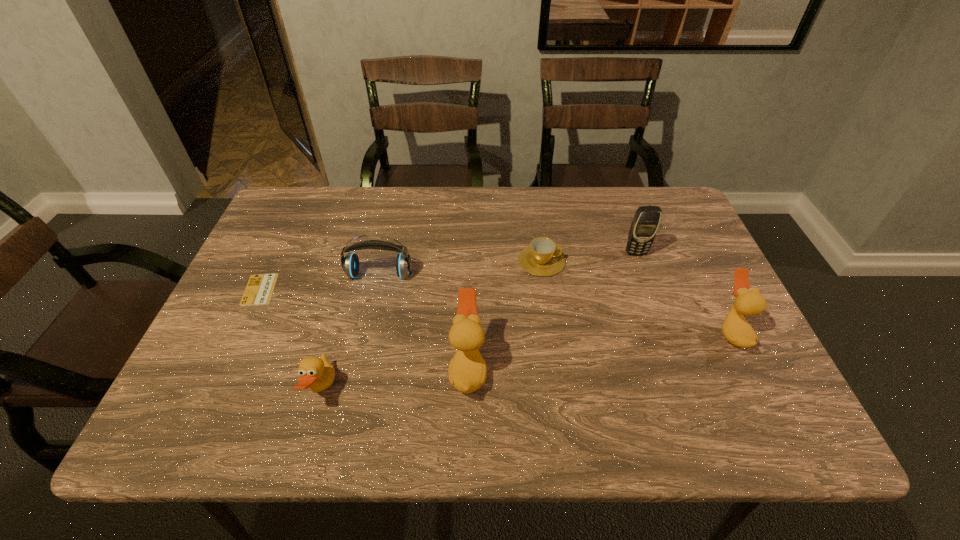
I want to click on location for an additional duck to make spacing equal, so click(x=604, y=350).